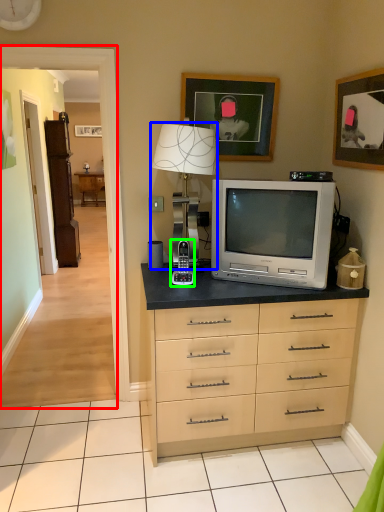
Question: Which is nearer to the corridor (highlighted by a red box)? table lamp (highlighted by a blue box) or appliance (highlighted by a green box).

Choices:
 (A) table lamp
 (B) appliance

Answer: (A)